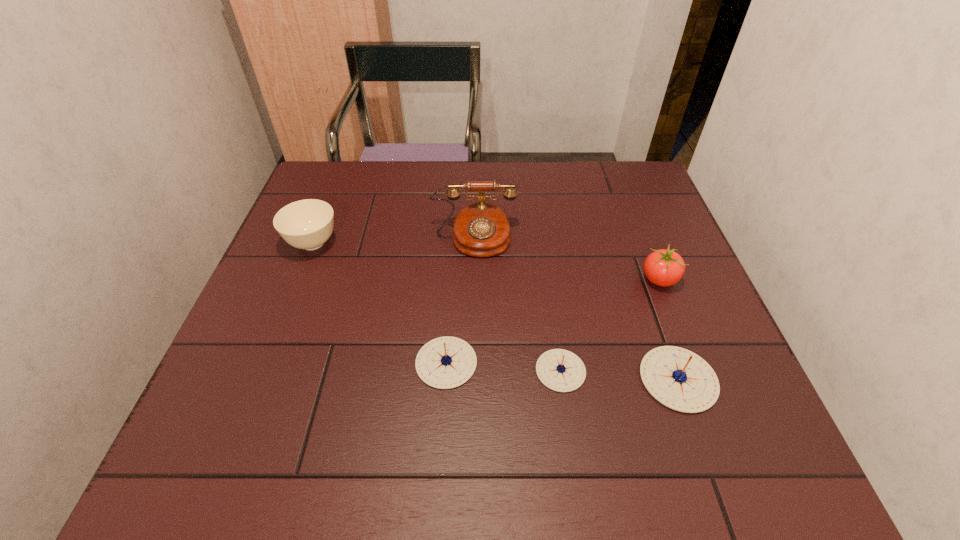
The image size is (960, 540). What are the coordinates of `free space between the rightmost compass and the fourth object from left to right` in the screenshot? It's located at [619, 375].

You are a GUI agent. You are given a task and a screenshot of the screen. Output one action in this format:
    pyautogui.click(x=<x>, y=<y>)
    Task: Click on the free space between the leftmost object and the telephone
    This screenshot has height=540, width=960.
    Given the screenshot: What is the action you would take?
    pyautogui.click(x=394, y=241)

Find the location of a particular element. This screenshot has height=540, width=960. free point between the leftmost object and the rightmost compass is located at coordinates 495,311.

Point out which object is positioned as the second nearest to the tomato. Please provide its 2D coordinates. Your answer should be formatted as a tuple, i.e. [(x, y)], where the tuple contains the x and y coordinates of a point satisfying the conditions above.

[(560, 370)]

Image resolution: width=960 pixels, height=540 pixels. In order to click on object that is the closest to the tallest object in this screenshot , I will do `click(307, 224)`.

Select which compass is the closest to the shortest compass. Please provide its 2D coordinates. Your answer should be formatted as a tuple, i.e. [(x, y)], where the tuple contains the x and y coordinates of a point satisfying the conditions above.

[(681, 380)]

Locate which compass is the second closest to the telephone. Please provide its 2D coordinates. Your answer should be formatted as a tuple, i.e. [(x, y)], where the tuple contains the x and y coordinates of a point satisfying the conditions above.

[(560, 370)]

Locate an element on the screen. vacant position in the image that satisfies the following two spatial constraints: 1. on the dial of the tomato; 2. on the left side of the telephone is located at coordinates (473, 280).

At what (x,y) coordinates should I click in order to perform the action: click on blank space that satisfies the following two spatial constraints: 1. on the dial of the third farthest object; 2. on the right side of the telephone. Please return your answer as a coordinate pair (x, y). This screenshot has width=960, height=540. Looking at the image, I should click on (473, 280).

Locate an element on the screen. vacant space that satisfies the following two spatial constraints: 1. on the dial of the tallest object; 2. on the right side of the tallest compass is located at coordinates 471,379.